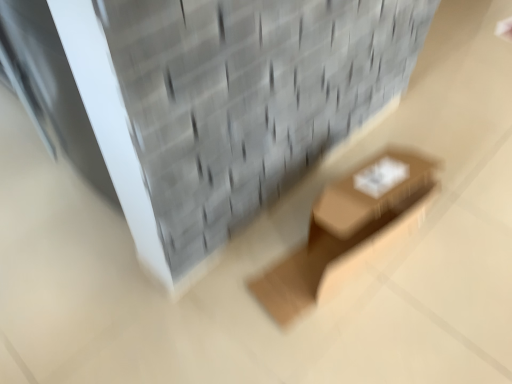
This screenshot has width=512, height=384. In order to click on brown cardboard box at center in this screenshot , I will do (x=346, y=229).

Measure the distance between brown cardboard box at center and camera.

brown cardboard box at center is 4.30 feet away from camera.

Describe the element at coordinates (346, 229) in the screenshot. I see `brown cardboard box at center` at that location.

The width and height of the screenshot is (512, 384). Identify the location of gray textured brickwork at upper center. (246, 101).

What do you see at coordinates (246, 101) in the screenshot?
I see `gray textured brickwork at upper center` at bounding box center [246, 101].

Where is `brown cardboard box at center`? This screenshot has width=512, height=384. brown cardboard box at center is located at coordinates (346, 229).

Between brown cardboard box at center and gray textured brickwork at upper center, which one appears on the left side from the viewer's perspective?

From the viewer's perspective, gray textured brickwork at upper center appears more on the left side.

In the image, is brown cardboard box at center positioned in front of or behind gray textured brickwork at upper center?

brown cardboard box at center is behind gray textured brickwork at upper center.

Which is behind, point (266, 296) or point (436, 3)?

Positioned behind is point (436, 3).

From the image's perspective, does brown cardboard box at center appear higher than gray textured brickwork at upper center?

No.

From a real-world perspective, is brown cardboard box at center on top of gray textured brickwork at upper center?

Indeed, from a real-world perspective, brown cardboard box at center stands above gray textured brickwork at upper center.

Between brown cardboard box at center and gray textured brickwork at upper center, which one has smaller width?

brown cardboard box at center is thinner.

Is brown cardboard box at center taller or shorter than gray textured brickwork at upper center?

In the image, brown cardboard box at center appears to be taller than gray textured brickwork at upper center.

Is brown cardboard box at center smaller than gray textured brickwork at upper center?

Yes, brown cardboard box at center is smaller than gray textured brickwork at upper center.

In the scene shown: Is brown cardboard box at center surrounding gray textured brickwork at upper center?

Definitely not — gray textured brickwork at upper center is not inside brown cardboard box at center.

Would you consider brown cardboard box at center to be distant from gray textured brickwork at upper center?

Actually, brown cardboard box at center and gray textured brickwork at upper center are a little close together.

Is brown cardboard box at center oriented towards gray textured brickwork at upper center?

No, brown cardboard box at center does not turn towards gray textured brickwork at upper center.

This screenshot has width=512, height=384. I want to click on furniture behind the gray textured brickwork at upper center, so click(x=346, y=229).

Considering the positions of objects gray textured brickwork at upper center and brown cardboard box at center in the image provided, who is more to the right, gray textured brickwork at upper center or brown cardboard box at center?

Positioned to the right is brown cardboard box at center.

Is gray textured brickwork at upper center positioned before brown cardboard box at center?

Yes, it is.

Which is nearer, (231, 196) or (417, 162)?

Point (231, 196)

From the image's perspective, does gray textured brickwork at upper center appear lower than brown cardboard box at center?

No, from the image's perspective, gray textured brickwork at upper center is not below brown cardboard box at center.

From a real-world perspective, which object rests below the other?

gray textured brickwork at upper center.

Which of these two, gray textured brickwork at upper center or brown cardboard box at center, is wider?

gray textured brickwork at upper center.

Which of these two, gray textured brickwork at upper center or brown cardboard box at center, stands taller?

brown cardboard box at center is taller.

Between gray textured brickwork at upper center and brown cardboard box at center, which one has smaller size?

Smaller between the two is brown cardboard box at center.

Looking at this image, is gray textured brickwork at upper center not within brown cardboard box at center?

Yes, gray textured brickwork at upper center is located beyond the bounds of brown cardboard box at center.

Is the surface of gray textured brickwork at upper center in direct contact with brown cardboard box at center?

No, gray textured brickwork at upper center is not touching brown cardboard box at center.

Is gray textured brickwork at upper center oriented towards brown cardboard box at center?

No, gray textured brickwork at upper center is not oriented towards brown cardboard box at center.

What's the angular difference between gray textured brickwork at upper center and brown cardboard box at center's facing directions?

The angular difference between gray textured brickwork at upper center and brown cardboard box at center is 172 degrees.

Image resolution: width=512 pixels, height=384 pixels. What are the coordinates of `furniture located on the right of gray textured brickwork at upper center` in the screenshot? It's located at (346, 229).

Find the location of a particular element. This screenshot has height=384, width=512. furniture above the gray textured brickwork at upper center (from a real-world perspective) is located at coordinates (346, 229).

The image size is (512, 384). Identify the location of brickwork that appears above the brown cardboard box at center (from the image's perspective). tap(246, 101).